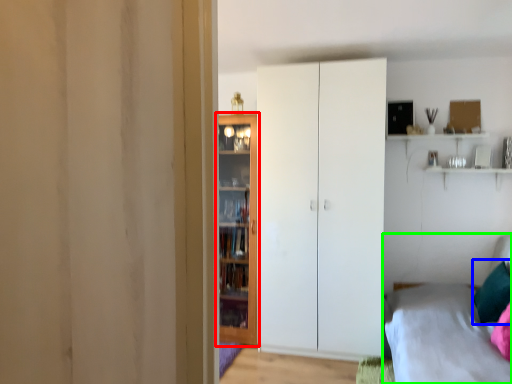
Question: Estimate the real-world distances between objects in this image. Which object is closer to door (highlighted by a red box), pillow (highlighted by a blue box) or bed (highlighted by a green box)?

Choices:
 (A) pillow
 (B) bed

Answer: (B)